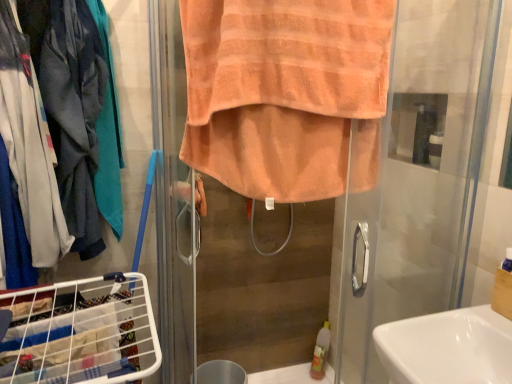
The height and width of the screenshot is (384, 512). What do you see at coordinates (285, 93) in the screenshot?
I see `orange terry towel at center` at bounding box center [285, 93].

Describe the element at coordinates (447, 347) in the screenshot. I see `white glossy sink at lower right` at that location.

The image size is (512, 384). Find the location of `white wire laundry basket at lower left`. white wire laundry basket at lower left is located at coordinates (81, 332).

Can you see white glossy sink at lower right touching white wire laundry basket at lower left?

No, white glossy sink at lower right is not with white wire laundry basket at lower left.

At what (x,y) coordinates should I click in order to perform the action: click on laundry basket that appears below the white glossy sink at lower right (from the image's perspective). Please return your answer as a coordinate pair (x, y). This screenshot has width=512, height=384. Looking at the image, I should click on (81, 332).

From a real-world perspective, is white glossy sink at lower right positioned above or below white wire laundry basket at lower left?

white glossy sink at lower right is above white wire laundry basket at lower left.

Which is more to the right, white glossy sink at lower right or matte gray jacket at left?

white glossy sink at lower right is more to the right.

Considering the relative sizes of white glossy sink at lower right and matte gray jacket at left in the image provided, is white glossy sink at lower right bigger than matte gray jacket at left?

Incorrect, white glossy sink at lower right is not larger than matte gray jacket at left.

Do you think white glossy sink at lower right is within matte gray jacket at left, or outside of it?

white glossy sink at lower right is outside matte gray jacket at left.

From the image's perspective, is white glossy sink at lower right located beneath matte gray jacket at left?

Correct, white glossy sink at lower right appears lower than matte gray jacket at left in the image.

Considering the sizes of objects orange towel at center and metallic silver trash bin/can at lower center in the image provided, who is wider, orange towel at center or metallic silver trash bin/can at lower center?

metallic silver trash bin/can at lower center is wider.

Is orange towel at center oriented away from metallic silver trash bin/can at lower center?

That's not correct — orange towel at center is not looking away from metallic silver trash bin/can at lower center.

Can you tell me how much orange towel at center and metallic silver trash bin/can at lower center differ in facing direction?

The angular difference between orange towel at center and metallic silver trash bin/can at lower center is 6.8 degrees.

From a real-world perspective, between orange towel at center and metallic silver trash bin/can at lower center, who is vertically higher?

orange towel at center is physically above.

Which object is positioned more to the right, white wire laundry basket at lower left or matte gray jacket at left?

Positioned to the right is white wire laundry basket at lower left.

Is point (34, 381) closer to camera compared to point (149, 95)?

Yes, point (34, 381) is in front of point (149, 95).

Who is smaller, orange terry towel at center or metallic silver trash bin/can at lower center?

Smaller between the two is metallic silver trash bin/can at lower center.

From a real-world perspective, which is physically below, orange terry towel at center or metallic silver trash bin/can at lower center?

In real-world perspective, metallic silver trash bin/can at lower center is lower.

Is orange terry towel at center wider than metallic silver trash bin/can at lower center?

Correct, the width of orange terry towel at center exceeds that of metallic silver trash bin/can at lower center.

Which point is more forward, [234,9] or [213,377]?

Positioned in front is point [234,9].

Consider the image. Is metallic silver trash bin/can at lower center closer to camera compared to orange terry towel at center?

No.

Considering the sizes of metallic silver trash bin/can at lower center and orange terry towel at center in the image, is metallic silver trash bin/can at lower center taller or shorter than orange terry towel at center?

Considering their sizes, metallic silver trash bin/can at lower center has less height than orange terry towel at center.

Consider the image. Is metallic silver trash bin/can at lower center oriented away from orange terry towel at center?

No, metallic silver trash bin/can at lower center's orientation is not away from orange terry towel at center.

From the image's perspective, which is below, metallic silver trash bin/can at lower center or orange terry towel at center?

metallic silver trash bin/can at lower center.

Is metallic silver trash bin/can at lower center positioned far away from orange towel at center?

metallic silver trash bin/can at lower center is near orange towel at center, not far away.

Can you tell me how much metallic silver trash bin/can at lower center and orange towel at center differ in facing direction?

The angle between the facing direction of metallic silver trash bin/can at lower center and the facing direction of orange towel at center is 6.8 degrees.

Is orange towel at center surrounded by metallic silver trash bin/can at lower center?

Actually, orange towel at center is outside metallic silver trash bin/can at lower center.

Considering the points (208, 362) and (465, 51), which point is behind, point (208, 362) or point (465, 51)?

The point (208, 362) is farther.

The height and width of the screenshot is (384, 512). Find the location of `sink located on the right of white wire laundry basket at lower left`. sink located on the right of white wire laundry basket at lower left is located at coordinates (447, 347).

You are a GUI agent. You are given a task and a screenshot of the screen. Output one action in this format:
    pyautogui.click(x=<x>, y=<y>)
    Task: Click on the closet above the white glossy sink at lower right (from the image's perspective)
    The width and height of the screenshot is (512, 384).
    Given the screenshot: What is the action you would take?
    pyautogui.click(x=133, y=71)

Based on their spatial positions, is matte gray jacket at left or white wire laundry basket at lower left further from metallic silver trash bin/can at lower center?

Among the two, matte gray jacket at left is located further to metallic silver trash bin/can at lower center.

Looking at the image, which one is located further to orange terry towel at center, orange towel at center or white wire laundry basket at lower left?

white wire laundry basket at lower left is positioned further to the anchor orange terry towel at center.

Looking at the image, which one is located closer to orange towel at center, metallic silver trash bin/can at lower center or matte gray jacket at left?

metallic silver trash bin/can at lower center is closer to orange towel at center.

When comparing their distances from orange towel at center, does white wire laundry basket at lower left or white glossy sink at lower right seem further?

white wire laundry basket at lower left is positioned further to the anchor orange towel at center.

Based on their spatial positions, is white glossy sink at lower right or metallic silver trash bin/can at lower center further from orange towel at center?

The object further to orange towel at center is metallic silver trash bin/can at lower center.

When comparing their distances from orange terry towel at center, does white glossy sink at lower right or matte gray jacket at left seem further?

matte gray jacket at left lies further to orange terry towel at center than the other object.

From the image, which object appears to be farther from orange towel at center, orange terry towel at center or white wire laundry basket at lower left?

white wire laundry basket at lower left is positioned further to the anchor orange towel at center.

Consider the image. Based on their spatial positions, is matte gray jacket at left or white glossy sink at lower right closer to orange terry towel at center?

Among the two, white glossy sink at lower right is located nearer to orange terry towel at center.

Identify the location of laundry basket that lies between orange terry towel at center and metallic silver trash bin/can at lower center from top to bottom. (81, 332).

Where is `trash bin/can between white wire laundry basket at lower left and orange towel at center in the horizontal direction`? This screenshot has width=512, height=384. trash bin/can between white wire laundry basket at lower left and orange towel at center in the horizontal direction is located at coordinates (219, 373).

Where is `trash bin/can between matte gray jacket at left and white glossy sink at lower right`? The width and height of the screenshot is (512, 384). trash bin/can between matte gray jacket at left and white glossy sink at lower right is located at coordinates (219, 373).

Where is `screen door situated between white wire laundry basket at lower left and white glossy sink at lower right from left to right`? This screenshot has height=384, width=512. screen door situated between white wire laundry basket at lower left and white glossy sink at lower right from left to right is located at coordinates (418, 179).